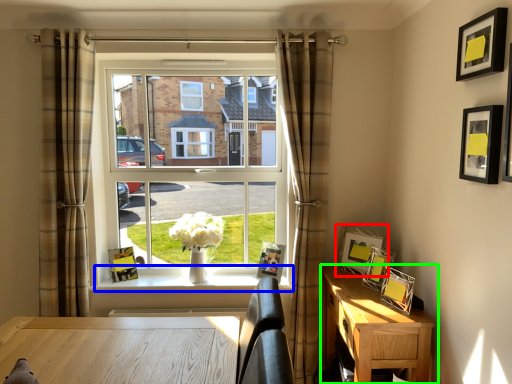
Question: Estimate the real-world distances between objects in this image. Which object is farther from picture frame (highlighted by a red box), window sill (highlighted by a blue box) or nightstand (highlighted by a green box)?

Choices:
 (A) window sill
 (B) nightstand

Answer: (A)